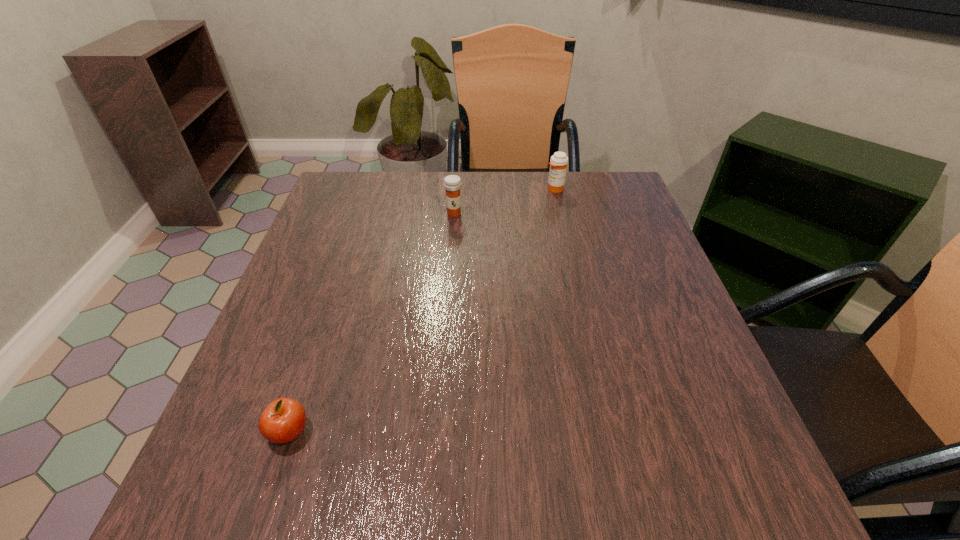
This screenshot has width=960, height=540. I want to click on the rightmost object, so click(x=558, y=163).

Locate an element on the screen. This screenshot has height=540, width=960. the right medicine is located at coordinates (558, 163).

The height and width of the screenshot is (540, 960). In order to click on the left medicine in this screenshot , I will do `click(452, 183)`.

Where is `the nearer medicine`? The image size is (960, 540). the nearer medicine is located at coordinates click(452, 183).

Locate an element on the screen. The height and width of the screenshot is (540, 960). the shortest object is located at coordinates (283, 420).

What are the coordinates of `apple` in the screenshot? It's located at (283, 420).

At what (x,y) coordinates should I click in order to perform the action: click on vacant space situated 0.200m on the left of the farthest object. Please return your answer as a coordinate pair (x, y). Looking at the image, I should click on (472, 189).

Where is `vacant space located 0.340m on the label side of the second farthest object`? The width and height of the screenshot is (960, 540). vacant space located 0.340m on the label side of the second farthest object is located at coordinates (446, 320).

Find the location of a particular element. Image resolution: width=960 pixels, height=540 pixels. blank area located on the back of the nearest object is located at coordinates (328, 316).

Locate an element on the screen. The height and width of the screenshot is (540, 960). object that is positioned at the left edge is located at coordinates (283, 420).